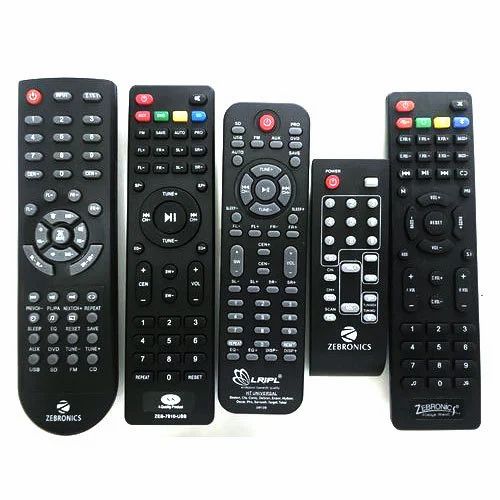
Image resolution: width=500 pixels, height=500 pixels. I want to click on power on buttons, so click(36, 95), click(143, 95), click(270, 124), click(329, 179), click(401, 108).